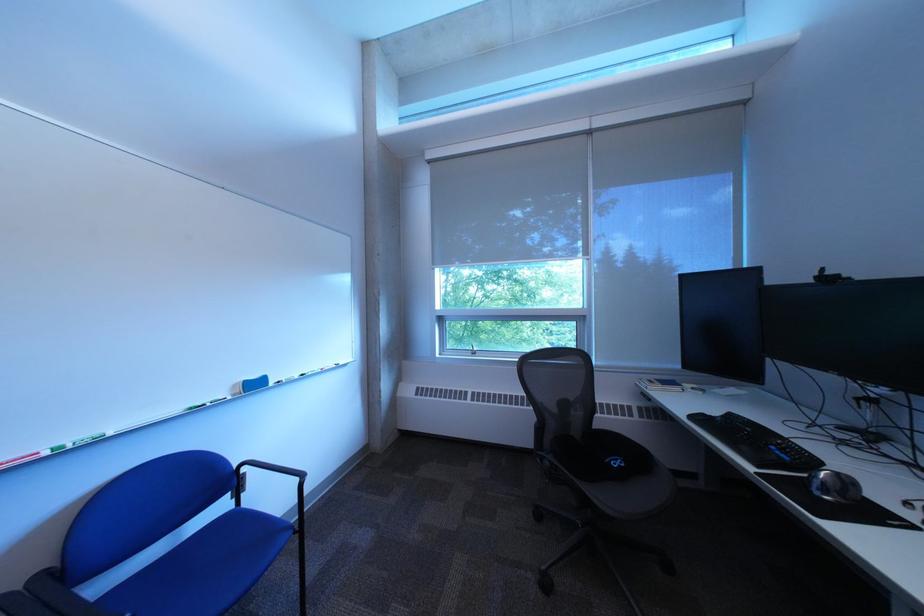
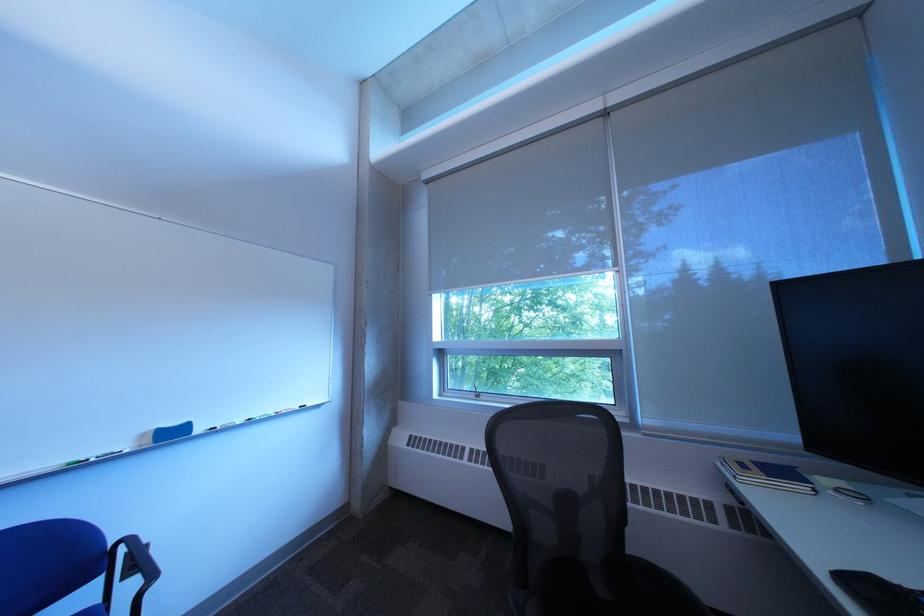
Which direction would the cameraman need to move to produce the second image?

The cameraman moved toward right, forward.